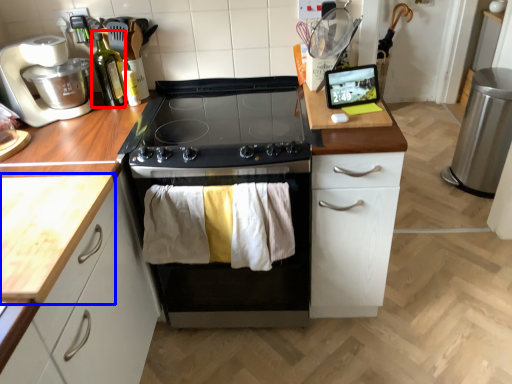
Question: Among these objects, which one is farthest to the camera, bottle (highlighted by a red box) or countertop (highlighted by a blue box)?

Choices:
 (A) bottle
 (B) countertop

Answer: (A)